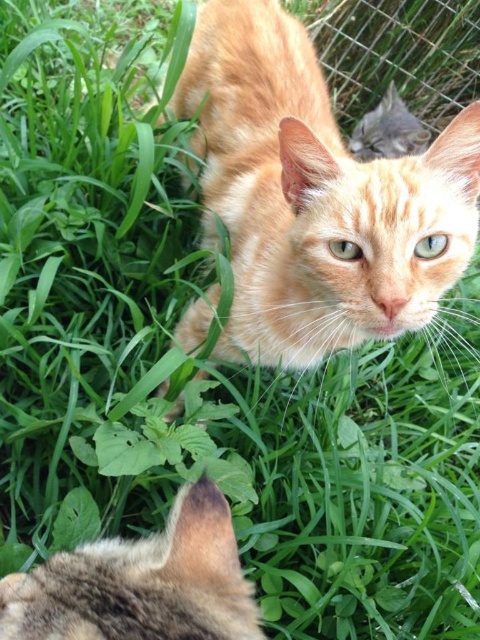
Question: Estimate the real-world distances between objects in this image. Which object is closer to the tabby fur ear at lower left?

Choices:
 (A) orange fur cat at center
 (B) metallic wire fence at upper right

Answer: (A)

Question: Does orange fur cat at center have a smaller size compared to metallic wire fence at upper right?

Choices:
 (A) yes
 (B) no

Answer: (B)

Question: Does orange fur cat at center appear over tabby fur ear at lower left?

Choices:
 (A) no
 (B) yes

Answer: (B)

Question: Which point is closer to the camera taking this photo?

Choices:
 (A) (331, 60)
 (B) (154, 630)

Answer: (B)

Question: Which point is closer to the camera?

Choices:
 (A) (377, 22)
 (B) (164, 630)

Answer: (B)

Question: From the image, what is the correct spatial relationship of orange fur cat at center in relation to metallic wire fence at upper right?

Choices:
 (A) below
 (B) above

Answer: (A)